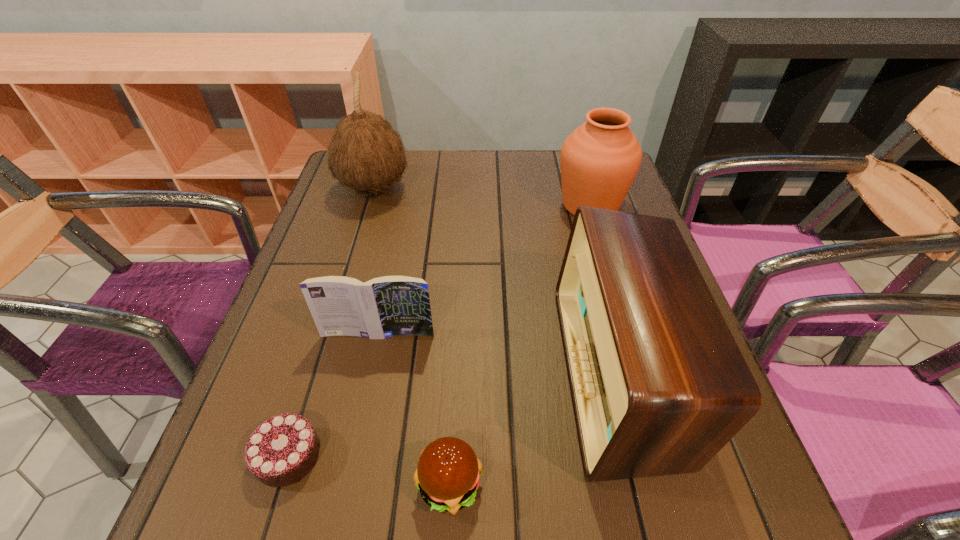
Find the location of a particular element. This screenshot has width=960, height=540. book that is at the left edge is located at coordinates (387, 306).

This screenshot has height=540, width=960. Find the location of `chocolate cake present at the left edge`. chocolate cake present at the left edge is located at coordinates (281, 451).

This screenshot has width=960, height=540. In order to click on urn located at the right edge in this screenshot , I will do `click(600, 159)`.

This screenshot has height=540, width=960. I want to click on radio receiver situated at the right edge, so click(x=659, y=386).

Locate an element on the screen. This screenshot has height=540, width=960. object situated at the far left corner is located at coordinates (366, 154).

Where is `object that is at the near left corner`? The image size is (960, 540). object that is at the near left corner is located at coordinates (281, 451).

Locate an element on the screen. The height and width of the screenshot is (540, 960). object at the far right corner is located at coordinates (600, 159).

The width and height of the screenshot is (960, 540). Identify the location of object at the near right corner. (659, 386).

In the image, there is a desktop. At what (x,y) coordinates should I click in order to perform the action: click on free space at the far edge. Please return your answer as a coordinate pair (x, y). Image resolution: width=960 pixels, height=540 pixels. Looking at the image, I should click on tap(471, 191).

The width and height of the screenshot is (960, 540). In order to click on blank space at the near edge of the desktop in this screenshot , I will do `click(416, 517)`.